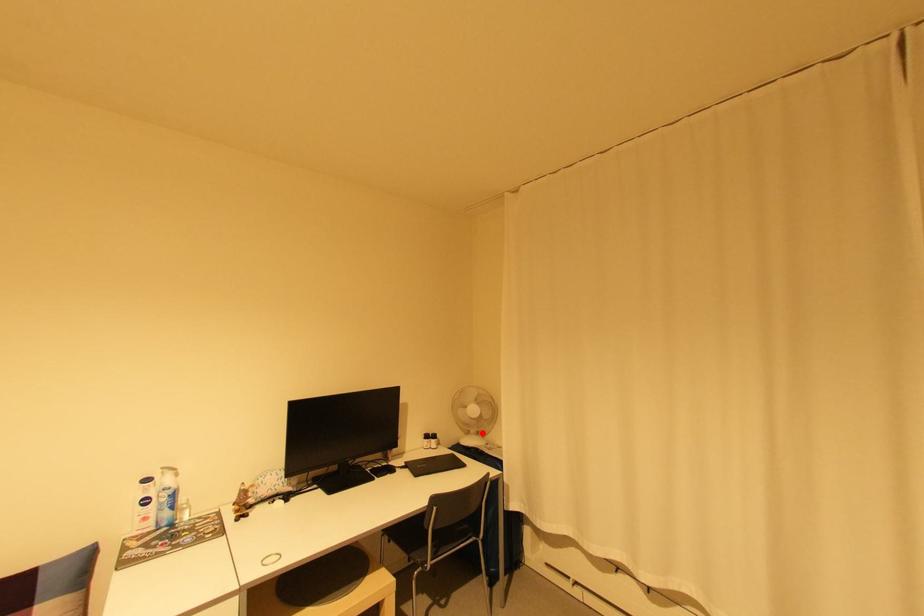
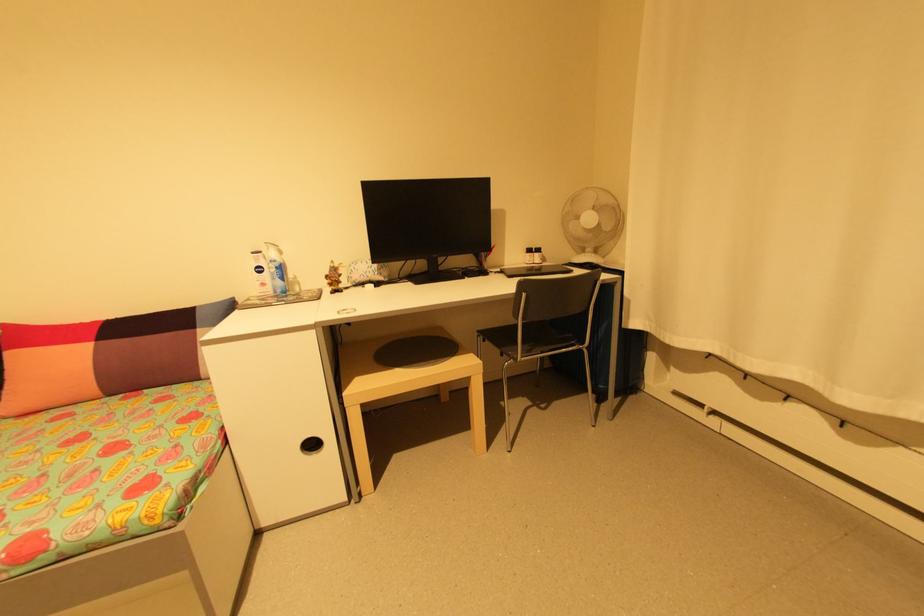
Find the pixel in the second image that matches the highlighted location in the first image.

(600, 252)